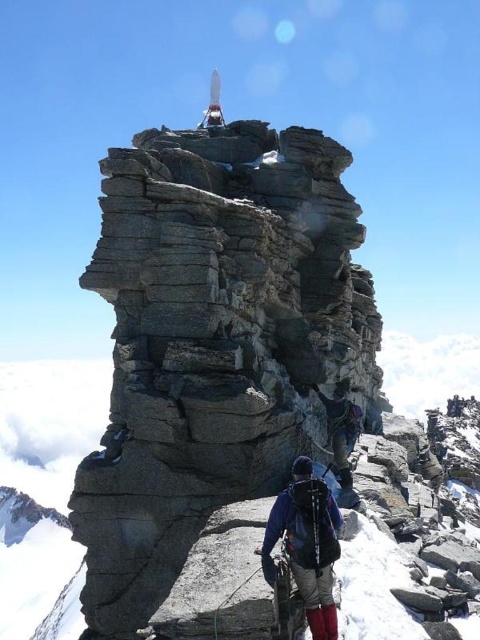
Is gray rough rock at center to the left of dark blue fabric backpack at center from the viewer's perspective?

Yes, gray rough rock at center is to the left of dark blue fabric backpack at center.

Which is more to the right, gray rough rock at center or dark blue fabric backpack at center?

From the viewer's perspective, dark blue fabric backpack at center appears more on the right side.

This screenshot has width=480, height=640. I want to click on gray rough rock at center, so [x=213, y=342].

Does matte blue jacket at center have a larger size compared to dark blue fabric backpack at center?

No.

Does matte blue jacket at center appear on the left side of dark blue fabric backpack at center?

Indeed, matte blue jacket at center is positioned on the left side of dark blue fabric backpack at center.

Describe the element at coordinates (307, 545) in the screenshot. I see `matte blue jacket at center` at that location.

The width and height of the screenshot is (480, 640). In order to click on matte blue jacket at center in this screenshot , I will do `click(307, 545)`.

Is gray rough rock at center behind matte blue jacket at center?

Yes, gray rough rock at center is further from the viewer.

What do you see at coordinates (213, 342) in the screenshot? I see `gray rough rock at center` at bounding box center [213, 342].

Locate an element on the screen. gray rough rock at center is located at coordinates (213, 342).